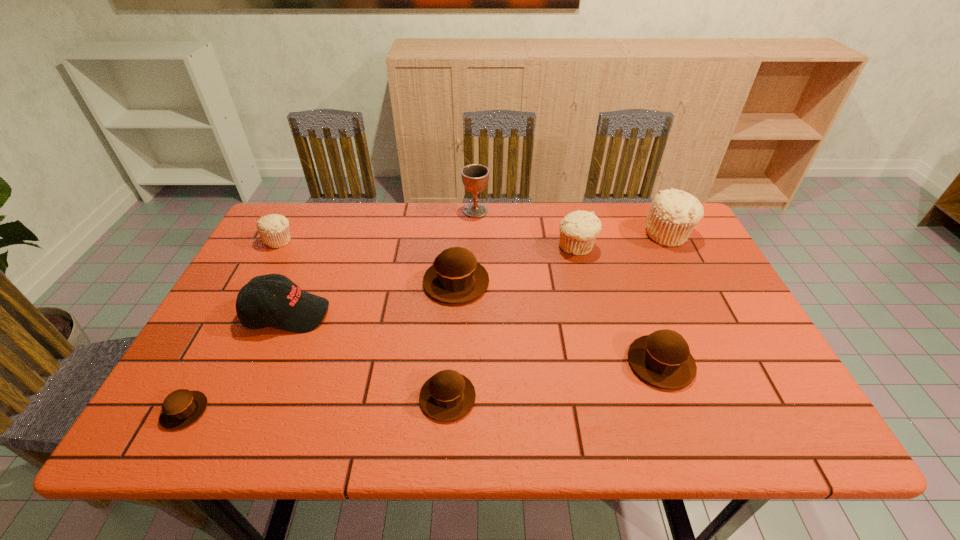
The image size is (960, 540). I want to click on brown chalice, so click(475, 177).

The height and width of the screenshot is (540, 960). I want to click on chalice, so (475, 177).

Where is `the rightmost object`? The height and width of the screenshot is (540, 960). the rightmost object is located at coordinates (673, 214).

You are a GUI agent. You are given a task and a screenshot of the screen. Output one action in this format:
    pyautogui.click(x=<x>, y=<y>)
    Task: Click on the biggest beige muffin
    This screenshot has width=960, height=540.
    Given the screenshot: What is the action you would take?
    pyautogui.click(x=673, y=214)

Where is `the second beige muffin from right to left`? This screenshot has height=540, width=960. the second beige muffin from right to left is located at coordinates (578, 230).

The width and height of the screenshot is (960, 540). What are the coordinates of `baseball cap` in the screenshot? It's located at (292, 309).

This screenshot has width=960, height=540. What are the coordinates of `the fourth nearest muffin` in the screenshot? It's located at pos(455,277).

Where is `the farthest brown muffin`? The image size is (960, 540). the farthest brown muffin is located at coordinates (455, 277).

Where is `the smallest beige muffin`? Image resolution: width=960 pixels, height=540 pixels. the smallest beige muffin is located at coordinates (274, 229).

Locate an element on the screen. The height and width of the screenshot is (540, 960). the rightmost brown muffin is located at coordinates (663, 359).